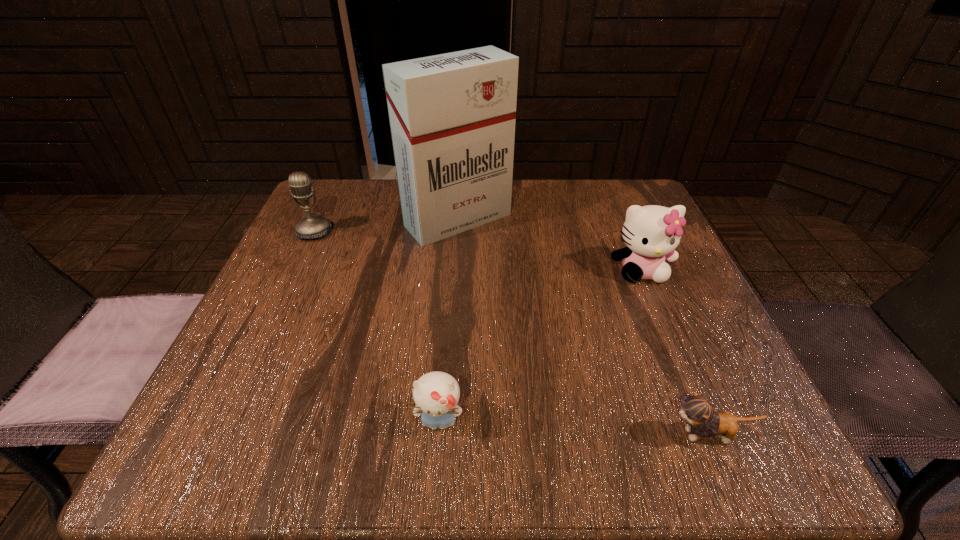
You are a GUI agent. You are given a task and a screenshot of the screen. Output one action in this format:
    pyautogui.click(x=<x>, y=<y>)
    Task: Click on the tallest object
    
    Given the screenshot: What is the action you would take?
    pyautogui.click(x=452, y=116)

At what (x,y) coordinates should I click in order to perform the action: click on the third farthest object. Please return your answer as a coordinate pair (x, y). Looking at the image, I should click on (652, 233).

Where is `the farthest kitten`? The width and height of the screenshot is (960, 540). the farthest kitten is located at coordinates (652, 233).

The height and width of the screenshot is (540, 960). I want to click on the leftmost object, so (312, 226).

Where is `the leftmost kitten`? the leftmost kitten is located at coordinates (436, 394).

Where is `the second tallest kitten`? The image size is (960, 540). the second tallest kitten is located at coordinates (436, 394).

Where is `the shortest kitten`? This screenshot has width=960, height=540. the shortest kitten is located at coordinates (699, 411).

Find the location of a particular element. free space located 0.100m on the front of the cigarette case is located at coordinates (454, 278).

Find the location of a particular element. vacant region located 0.310m on the front-facing side of the tallest kitten is located at coordinates (708, 436).

In order to click on free space located on the front-facing side of the microphone in this screenshot , I will do `click(289, 287)`.